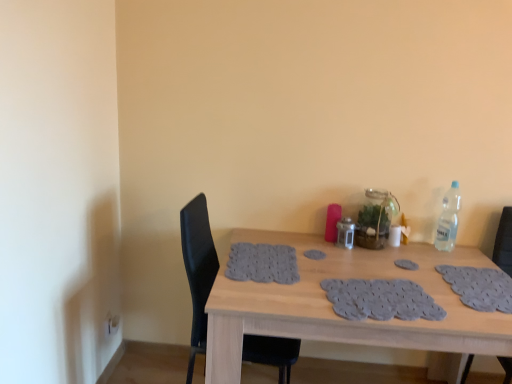
Question: In terms of width, does gray fabric placemat at center, positioned as the first footprint in right-to-left order, look wider or thinner when compared to gray fabric footprint at center, which ranks as the 1th footprint in top-to-bottom order?

Choices:
 (A) thin
 (B) wide

Answer: (A)

Question: Considering the positions of gray fabric placemat at center, positioned as the first footprint in right-to-left order, and gray fabric footprint at center, placed as the 1th footprint when sorted from left to right, in the image, is gray fabric placemat at center, positioned as the first footprint in right-to-left order, bigger or smaller than gray fabric footprint at center, placed as the 1th footprint when sorted from left to right,?

Choices:
 (A) big
 (B) small

Answer: (B)

Question: Which of these objects is positioned closest to the black leather chair at left, which is counted as the first chair, starting from the left?

Choices:
 (A) black leather chair at right, which is counted as the 2th chair, starting from the left
 (B) wooden table at center
 (C) gray fabric footprint at center, which ranks as the 1th footprint in top-to-bottom order
 (D) gray fabric placemat at center, placed as the second footprint when sorted from left to right
 (E) clear plastic bottle at upper right

Answer: (C)

Question: Which object is positioned farthest from the black leather chair at left, which is the second chair in right-to-left order?

Choices:
 (A) clear plastic bottle at upper right
 (B) gray fabric placemat at center, placed as the second footprint when sorted from left to right
 (C) black leather chair at right, which is the first chair in right-to-left order
 (D) wooden table at center
 (E) gray fabric footprint at center, placed as the 2th footprint when sorted from bottom to top

Answer: (C)